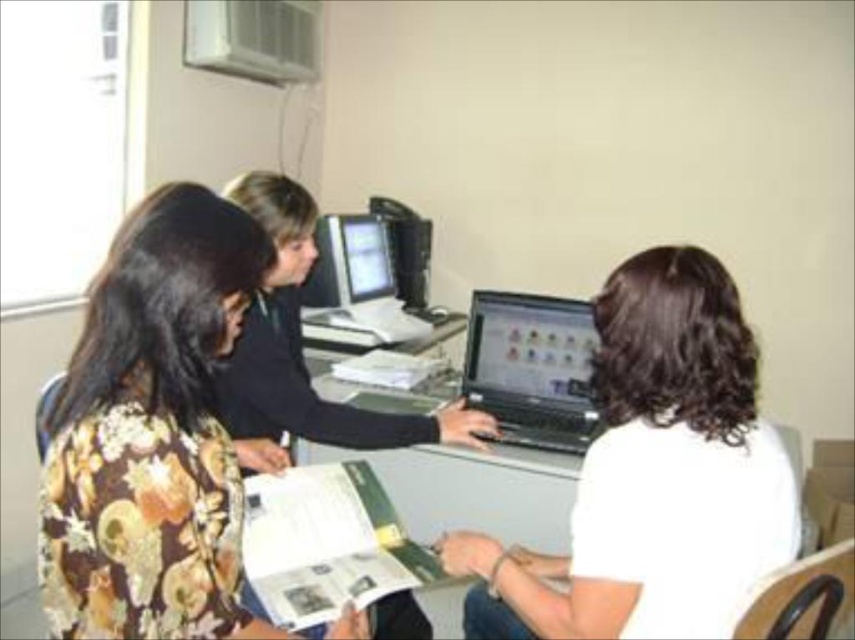
Is white matte laptop at center in front of shiny black laptop at center?

Yes, white matte laptop at center is in front of shiny black laptop at center.

Is point (590, 579) positioned behind point (523, 410)?

No, (590, 579) is closer to viewer.

I want to click on white matte laptop at center, so click(x=653, y=474).

Can you confirm if black plastic computer desk at center is wider than shiny black laptop at center?

Yes, black plastic computer desk at center is wider than shiny black laptop at center.

Which is above, black plastic computer desk at center or shiny black laptop at center?

shiny black laptop at center

This screenshot has height=640, width=855. Describe the element at coordinates (500, 429) in the screenshot. I see `black plastic computer desk at center` at that location.

You are a GUI agent. You are given a task and a screenshot of the screen. Output one action in this format:
    pyautogui.click(x=<x>, y=<y>)
    Task: Click on the black plastic computer desk at center
    This screenshot has width=855, height=640.
    Given the screenshot: What is the action you would take?
    pyautogui.click(x=500, y=429)

Is white matte laptop at center shorter than matte plastic monitor at center?

No, white matte laptop at center is not shorter than matte plastic monitor at center.

This screenshot has width=855, height=640. What are the coordinates of `white matte laptop at center` in the screenshot? It's located at (653, 474).

What do you see at coordinates (653, 474) in the screenshot? I see `white matte laptop at center` at bounding box center [653, 474].

Find the location of `white matte laptop at center`. white matte laptop at center is located at coordinates (653, 474).